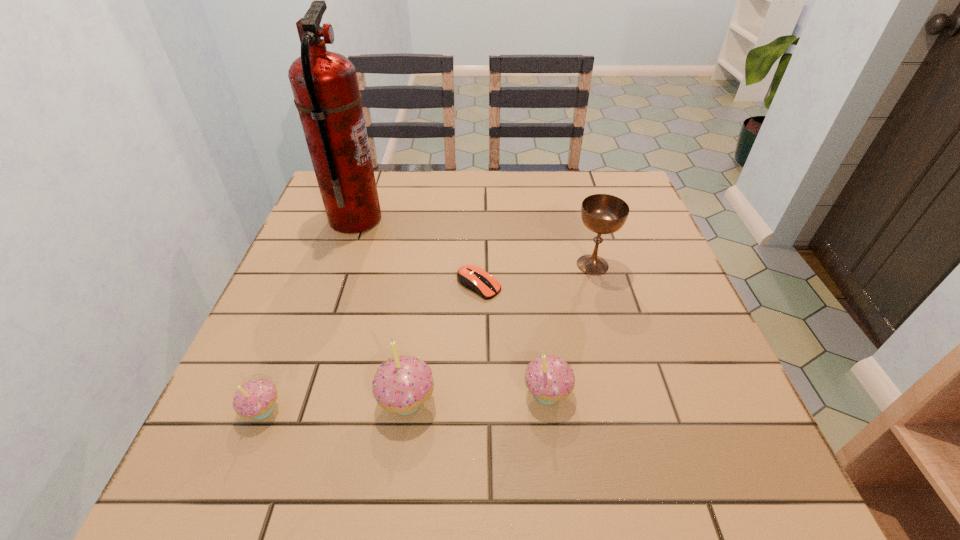
With all cupcakes evenly spaced, where should an extra cupcake be placed on the right to continue the pattern? Please point out a vacant space. Please provide its 2D coordinates. Your answer should be formatted as a tuple, i.e. [(x, y)], where the tuple contains the x and y coordinates of a point satisfying the conditions above.

[(684, 384)]